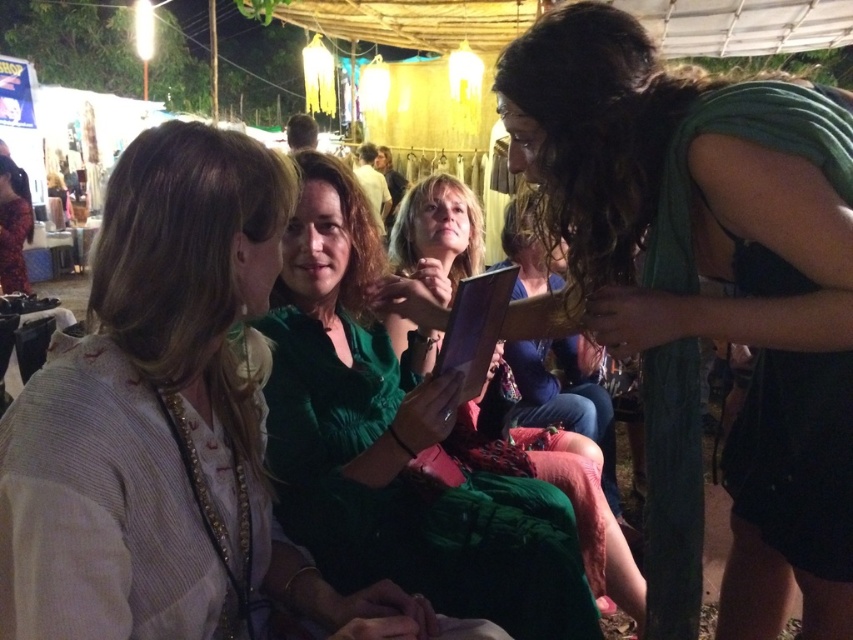
Is green fabric scarf at center to the right of matte green dress at center from the viewer's perspective?

Yes, green fabric scarf at center is to the right of matte green dress at center.

Who is more forward, (805, 264) or (131, 424)?

Point (131, 424) is more forward.

What do you see at coordinates (709, 298) in the screenshot?
I see `green fabric scarf at center` at bounding box center [709, 298].

Locate an element on the screen. Image resolution: width=853 pixels, height=640 pixels. green fabric scarf at center is located at coordinates (709, 298).

Is matte green dress at center above green satin dress at center?

Yes.

Does matte green dress at center have a lesser width compared to green satin dress at center?

Yes.

Which is in front, point (10, 500) or point (347, 461)?

Positioned in front is point (10, 500).

In order to click on matte green dress at center in this screenshot , I will do `click(169, 424)`.

Does green fabric scarf at center appear on the right side of green satin dress at center?

Correct, you'll find green fabric scarf at center to the right of green satin dress at center.

Measure the distance between point (650, 205) and camera.

1.22 meters

Is point (547, 61) closer to viewer compared to point (457, 516)?

Yes.

Find the location of a particular element. green fabric scarf at center is located at coordinates (709, 298).